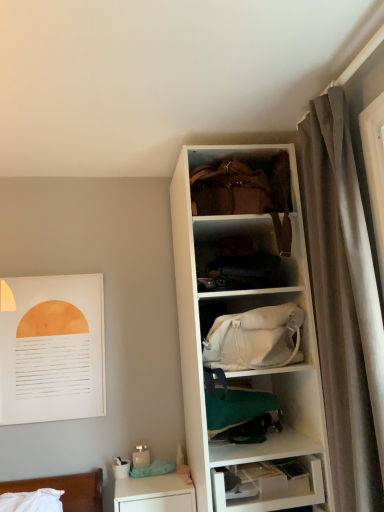
Question: Does white glossy table at lower left come behind velvet gray curtain at right?

Choices:
 (A) no
 (B) yes

Answer: (B)

Question: Considering the relative sizes of white glossy table at lower left and velvet gray curtain at right in the image provided, is white glossy table at lower left taller than velvet gray curtain at right?

Choices:
 (A) no
 (B) yes

Answer: (A)

Question: From a real-world perspective, is white glossy table at lower left on top of velvet gray curtain at right?

Choices:
 (A) no
 (B) yes

Answer: (A)

Question: Does white glossy table at lower left come in front of velvet gray curtain at right?

Choices:
 (A) no
 (B) yes

Answer: (A)

Question: Is white glossy table at lower left at the left side of velvet gray curtain at right?

Choices:
 (A) yes
 (B) no

Answer: (A)

Question: Is white matte cabinet at center bigger or smaller than green fabric bag at center, the 3th shelf from the top?

Choices:
 (A) small
 (B) big

Answer: (B)

Question: From the image's perspective, is white matte cabinet at center located above or below green fabric bag at center, the 3th shelf from the top?

Choices:
 (A) above
 (B) below

Answer: (A)

Question: Is white matte cabinet at center to the left or to the right of green fabric bag at center, the second shelf in the bottom-to-top sequence, in the image?

Choices:
 (A) right
 (B) left

Answer: (B)

Question: Considering the positions of point (246, 187) and point (271, 446), is point (246, 187) closer or farther from the camera than point (271, 446)?

Choices:
 (A) closer
 (B) farther

Answer: (B)

Question: Looking at the image, does white matte cabinet at center seem bigger or smaller compared to matte black clothing at center, the fourth shelf ordered from the bottom?

Choices:
 (A) big
 (B) small

Answer: (A)

Question: Considering the positions of white matte cabinet at center and matte black clothing at center, acting as the first shelf starting from the top, in the image, is white matte cabinet at center taller or shorter than matte black clothing at center, acting as the first shelf starting from the top,?

Choices:
 (A) short
 (B) tall

Answer: (B)

Question: From a real-world perspective, is white matte cabinet at center positioned above or below matte black clothing at center, acting as the first shelf starting from the top?

Choices:
 (A) above
 (B) below

Answer: (A)

Question: Is white matte cabinet at center in front of or behind matte black clothing at center, the fourth shelf ordered from the bottom, in the image?

Choices:
 (A) behind
 (B) front

Answer: (B)

Question: Considering the positions of point pos(327,205) and point pos(226,158), is point pos(327,205) closer or farther from the camera than point pos(226,158)?

Choices:
 (A) closer
 (B) farther

Answer: (A)

Question: Based on their sizes in the image, would you say velvet gray curtain at right is bigger or smaller than white matte cabinet at center?

Choices:
 (A) big
 (B) small

Answer: (A)